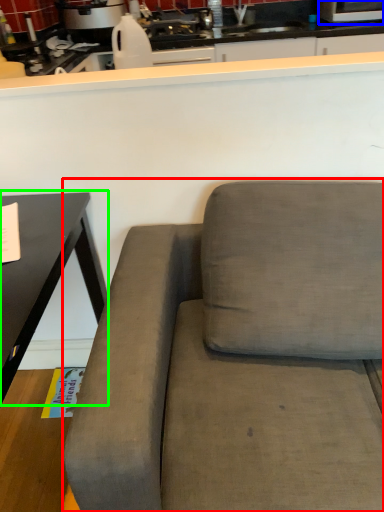
Question: Which is nearer to the studio couch (highlighted by a red box)? appliance (highlighted by a blue box) or table (highlighted by a green box).

Choices:
 (A) appliance
 (B) table

Answer: (B)